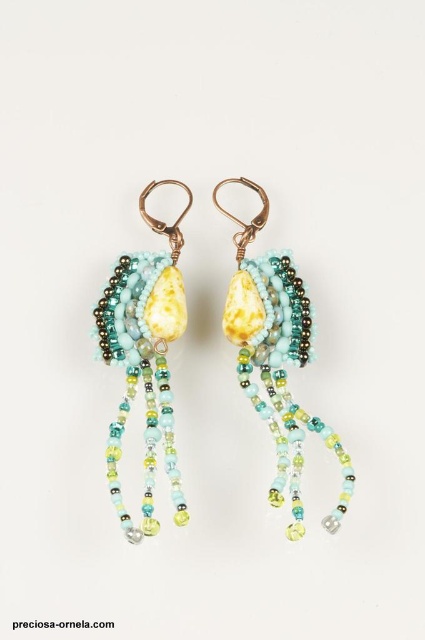
You are a jewelry designer trying to create a pair of earrings that are symmetrical. You have a matte glass bead earring at left and a matte yellow stone at center. Which object has a smaller width and should be mirrored on the other side for balance?

The matte glass bead earring at left has a lesser width compared to the matte yellow stone at center, so it should be mirrored on the other side to achieve symmetry.

You are an appraiser examining the earrings. You need to determine which object is nearer to you between the matte glass bead earring at left and the matte yellow stone at center. Which one is closer?

The matte glass bead earring at left is closer to the viewer than the matte yellow stone at center.